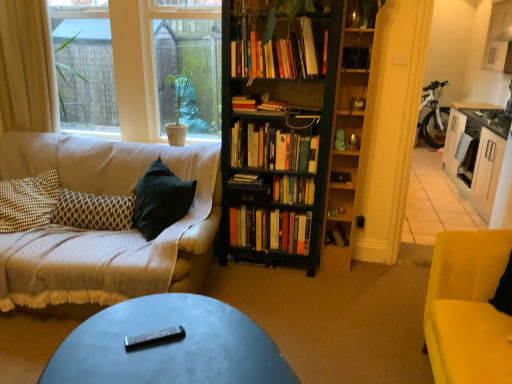
Image resolution: width=512 pixels, height=384 pixels. Find the location of `free spot to the right of wooden shelf at right`. free spot to the right of wooden shelf at right is located at coordinates (370, 264).